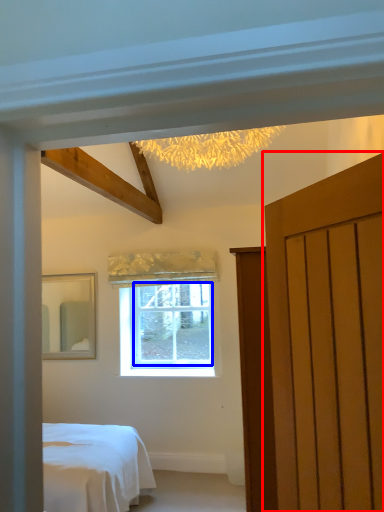
Question: Which point is further to the camera, door (highlighted by a red box) or window screen (highlighted by a blue box)?

Choices:
 (A) door
 (B) window screen

Answer: (B)